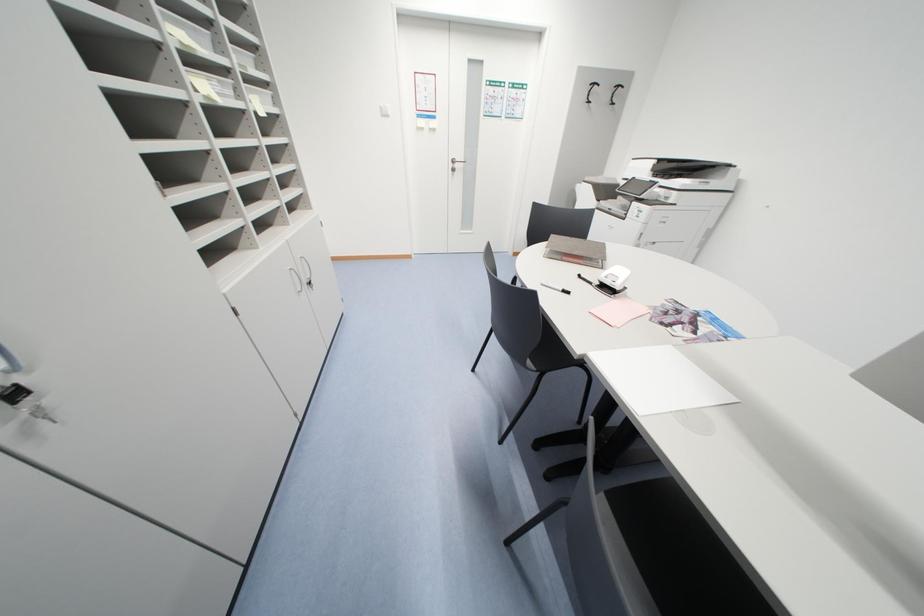
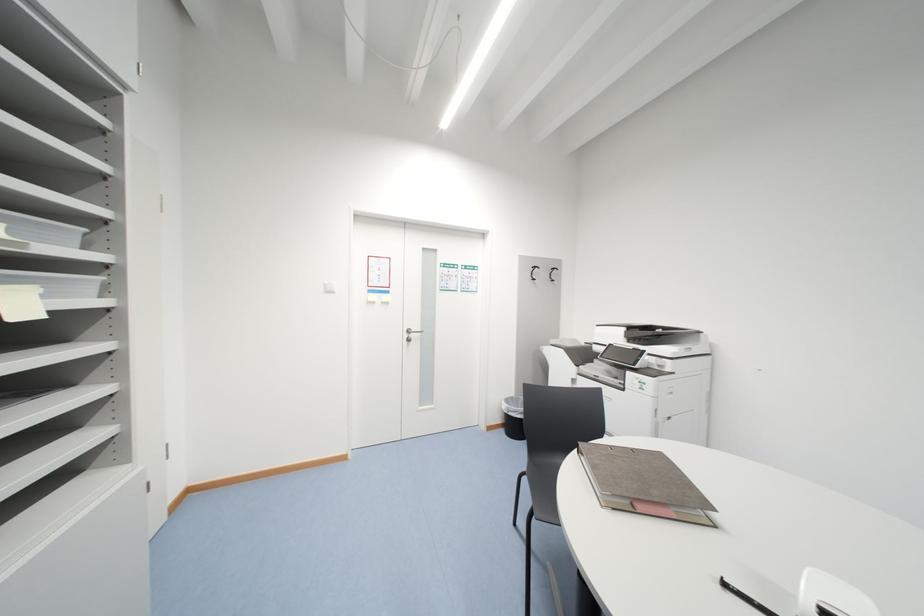
Based on the continuous images, in which direction is the camera rotating?

The camera rotated toward right-up.